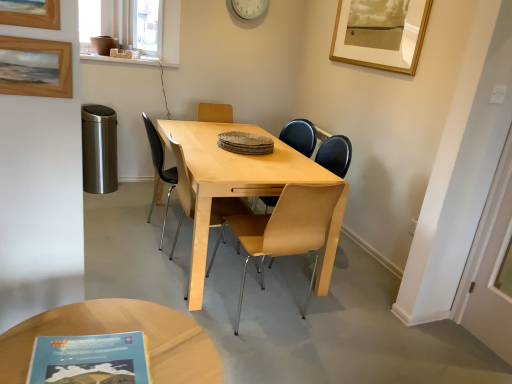
Image resolution: width=512 pixels, height=384 pixels. What do you see at coordinates (31, 13) in the screenshot?
I see `wooden picture frame at upper left, the 2th picture frame ordered from the bottom` at bounding box center [31, 13].

Describe the element at coordinates (35, 67) in the screenshot. This screenshot has height=384, width=512. I see `wooden picture frame at upper left, arranged as the first picture frame when viewed from the left` at that location.

Measure the distance between white plastic clock at upper center and camera.

They are 12.34 feet apart.

Locate an element on the screen. Image resolution: width=512 pixels, height=384 pixels. light brown leather chair at center, the 2th chair from the back is located at coordinates (335, 154).

Is light brown leather chair at center, the 2th chair from the back, positioned with its back to white plastic clock at upper center?

No, white plastic clock at upper center is not at the back of light brown leather chair at center, the 2th chair from the back.

From the image's perspective, relative to white plastic clock at upper center, is light brown leather chair at center, the 2th chair from the back, above or below?

light brown leather chair at center, the 2th chair from the back, is below white plastic clock at upper center.

Considering the relative positions of light brown leather chair at center, marked as the first chair in a front-to-back arrangement, and white plastic clock at upper center in the image provided, is light brown leather chair at center, marked as the first chair in a front-to-back arrangement, behind white plastic clock at upper center?

That is False.

How many degrees apart are the facing directions of light brown leather chair at center, the 2th chair from the back, and white plastic clock at upper center?

They differ by 90.8 degrees in their facing directions.

In terms of height, does white plastic clock at upper center look taller or shorter compared to light brown wooden coffee table at lower left?

In the image, white plastic clock at upper center appears to be shorter than light brown wooden coffee table at lower left.

Does point (253, 12) come farther from viewer compared to point (180, 334)?

Yes, point (253, 12) is farther from viewer.

Is white plastic clock at upper center situated inside light brown wooden coffee table at lower left or outside?

white plastic clock at upper center is not inside light brown wooden coffee table at lower left, it's outside.

Is white plastic clock at upper center wider or thinner than light brown wooden coffee table at lower left?

white plastic clock at upper center is thinner than light brown wooden coffee table at lower left.

From a real-world perspective, which is physically above, wooden picture frame at upper left, which is counted as the 3th picture frame, starting from the right, or light brown wooden coffee table at lower left?

wooden picture frame at upper left, which is counted as the 3th picture frame, starting from the right, is physically above.

The height and width of the screenshot is (384, 512). In order to click on coffee table that appears in front of the wooden picture frame at upper left, arranged as the 3th picture frame when viewed from the top in this screenshot , I will do `click(117, 332)`.

Which of these two, wooden picture frame at upper left, acting as the 2th picture frame starting from the front, or light brown wooden coffee table at lower left, is thinner?

wooden picture frame at upper left, acting as the 2th picture frame starting from the front.

Does wooden picture frame at upper left, arranged as the first picture frame when viewed from the left, have a lesser height compared to light brown wooden coffee table at lower left?

Indeed, wooden picture frame at upper left, arranged as the first picture frame when viewed from the left, has a lesser height compared to light brown wooden coffee table at lower left.

Where is `book in front of the light brown leather chair at center, the 2th chair from the back`? book in front of the light brown leather chair at center, the 2th chair from the back is located at coordinates (90, 359).

From a real-world perspective, does blue paperback book at lower left sit lower than light brown leather chair at center, marked as the first chair in a front-to-back arrangement?

No, from a real-world perspective, blue paperback book at lower left is not under light brown leather chair at center, marked as the first chair in a front-to-back arrangement.

Looking at this image, from the image's perspective, which one is positioned higher, blue paperback book at lower left or light brown leather chair at center, marked as the first chair in a front-to-back arrangement?

light brown leather chair at center, marked as the first chair in a front-to-back arrangement.

Is blue paperback book at lower left turned away from light brown leather chair at center, marked as the first chair in a front-to-back arrangement?

No, blue paperback book at lower left is not facing the opposite direction of light brown leather chair at center, marked as the first chair in a front-to-back arrangement.

From a real-world perspective, count 1st picture frames upward from the wooden picture frame at upper left, the first picture frame in the bottom-to-top sequence, and point to it. Please provide its 2D coordinates.

[(31, 13)]

From the image's perspective, is wooden picture frame at upper left, which is the second picture frame from back to front, located above wooden picture frame at upper left, the 2th picture frame ordered from the bottom?

No, from the image's perspective, wooden picture frame at upper left, which is the second picture frame from back to front, is not over wooden picture frame at upper left, the 2th picture frame ordered from the bottom.

Who is more distant, wooden picture frame at upper left, arranged as the 3th picture frame when viewed from the top, or wooden picture frame at upper left, the 2th picture frame from the top?

wooden picture frame at upper left, arranged as the 3th picture frame when viewed from the top, is further from the camera.

Can you confirm if wooden picture frame at upper left, which is the second picture frame from back to front, is thinner than wooden picture frame at upper left, marked as the 2th picture frame in a left-to-right arrangement?

Incorrect, the width of wooden picture frame at upper left, which is the second picture frame from back to front, is not less than that of wooden picture frame at upper left, marked as the 2th picture frame in a left-to-right arrangement.

What are the coordinates of `book below the transparent plastic window screen at upper left (from the image's perspective)` in the screenshot? It's located at (90, 359).

From a real-world perspective, is blue paperback book at lower left over transparent plastic window screen at upper left?

Actually, blue paperback book at lower left is physically below transparent plastic window screen at upper left in the real world.

Considering the relative sizes of blue paperback book at lower left and transparent plastic window screen at upper left in the image provided, is blue paperback book at lower left shorter than transparent plastic window screen at upper left?

Correct, blue paperback book at lower left is not as tall as transparent plastic window screen at upper left.

Is blue paperback book at lower left positioned with its back to transparent plastic window screen at upper left?

That's not correct — blue paperback book at lower left is not looking away from transparent plastic window screen at upper left.

Can you tell me how much transparent plastic window screen at upper left and wooden picture frame at upper left, arranged as the 3th picture frame when viewed from the top, differ in facing direction?

44.6 degrees separate the facing orientations of transparent plastic window screen at upper left and wooden picture frame at upper left, arranged as the 3th picture frame when viewed from the top.

Is transparent plastic window screen at upper left facing away from wooden picture frame at upper left, arranged as the 3th picture frame when viewed from the top?

transparent plastic window screen at upper left is not turned away from wooden picture frame at upper left, arranged as the 3th picture frame when viewed from the top.

From the image's perspective, which is above, transparent plastic window screen at upper left or wooden picture frame at upper left, which is the second picture frame from back to front?

transparent plastic window screen at upper left, from the image's perspective.

Between transparent plastic window screen at upper left and wooden picture frame at upper left, arranged as the 3th picture frame when viewed from the top, which one has larger size?

With larger size is transparent plastic window screen at upper left.

The image size is (512, 384). Find the location of `chair that is the 1st one when counting downward from the white plastic clock at upper center (from the image's perspective)`. chair that is the 1st one when counting downward from the white plastic clock at upper center (from the image's perspective) is located at coordinates (335, 154).

Find the location of `clock to the right of light brown wooden coffee table at lower left`. clock to the right of light brown wooden coffee table at lower left is located at coordinates (247, 9).

When comparing their distances from transparent plastic window screen at upper left, does wooden framed artwork at upper right, arranged as the third picture frame when ordered from the bottom, or light brown wood chair at center, the first chair when ordered from back to front, seem further?

The object further to transparent plastic window screen at upper left is wooden framed artwork at upper right, arranged as the third picture frame when ordered from the bottom.

Which object lies nearer to the anchor point transparent plastic window screen at upper left, wooden picture frame at upper left, arranged as the first picture frame when viewed from the left, or wooden framed artwork at upper right, the third picture frame in the left-to-right sequence?

Based on the image, wooden framed artwork at upper right, the third picture frame in the left-to-right sequence, appears to be nearer to transparent plastic window screen at upper left.

From the image, which object appears to be nearer to wooden framed artwork at upper right, arranged as the third picture frame when ordered from the bottom, light brown leather chair at center, marked as the first chair in a front-to-back arrangement, or light brown wood chair at center, the first chair when ordered from back to front?

Among the two, light brown leather chair at center, marked as the first chair in a front-to-back arrangement, is located nearer to wooden framed artwork at upper right, arranged as the third picture frame when ordered from the bottom.

Considering their positions, is light brown wooden coffee table at lower left positioned closer to wooden picture frame at upper left, acting as the 2th picture frame starting from the front, than transparent plastic window screen at upper left?

Based on the image, light brown wooden coffee table at lower left appears to be nearer to wooden picture frame at upper left, acting as the 2th picture frame starting from the front.

Which object lies further to the anchor point light brown wood chair at center, placed as the second chair when sorted from front to back, wooden framed artwork at upper right, the third picture frame in the left-to-right sequence, or white plastic clock at upper center?

wooden framed artwork at upper right, the third picture frame in the left-to-right sequence, lies further to light brown wood chair at center, placed as the second chair when sorted from front to back, than the other object.

From the image, which object appears to be farther from blue paperback book at lower left, wooden picture frame at upper left, placed as the first picture frame when sorted from front to back, or light brown wood chair at center, the first chair when ordered from back to front?

light brown wood chair at center, the first chair when ordered from back to front, is positioned further to the anchor blue paperback book at lower left.

Estimate the real-world distances between objects in this image. Which object is closer to light brown wood chair at center, the first chair when ordered from back to front, blue paperback book at lower left or wooden picture frame at upper left, placed as the first picture frame when sorted from front to back?

blue paperback book at lower left is positioned closer to the anchor light brown wood chair at center, the first chair when ordered from back to front.

Estimate the real-world distances between objects in this image. Which object is closer to wooden framed artwork at upper right, arranged as the third picture frame when ordered from the bottom, wooden picture frame at upper left, the 2th picture frame from the top, or light brown leather chair at center, the 2th chair from the back?

light brown leather chair at center, the 2th chair from the back, is positioned closer to the anchor wooden framed artwork at upper right, arranged as the third picture frame when ordered from the bottom.

Identify the location of chair positioned between light brown wooden coffee table at lower left and light brown wood chair at center, the first chair when ordered from back to front, from near to far. (335, 154).

Locate an element on the screen. The image size is (512, 384). picture frame positioned between wooden picture frame at upper left, which is counted as the 3th picture frame, starting from the right, and transparent plastic window screen at upper left from near to far is located at coordinates (380, 33).

Locate an element on the screen. This screenshot has height=384, width=512. coffee table between blue paperback book at lower left and wooden framed artwork at upper right, which appears as the 1th picture frame when viewed from the back, in the front-back direction is located at coordinates [x=117, y=332].

This screenshot has width=512, height=384. Identify the location of window screen between light brown leather chair at center, marked as the first chair in a front-to-back arrangement, and white plastic clock at upper center in the front-back direction. (141, 26).